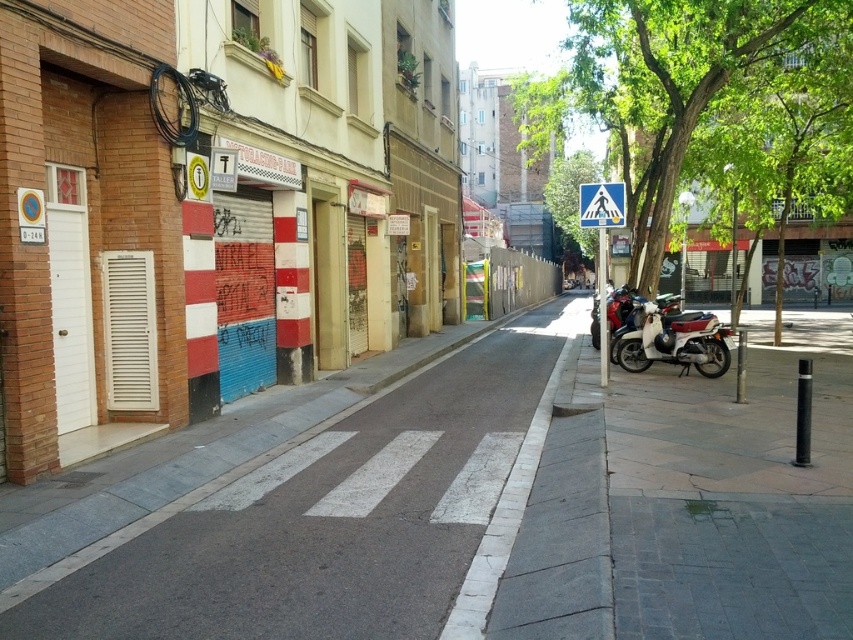
Is metallic blue scooter at right bigger than blue plastic pedestrian crossing sign at center?

No, metallic blue scooter at right is not bigger than blue plastic pedestrian crossing sign at center.

Which is below, metallic blue scooter at right or blue plastic pedestrian crossing sign at center?

Positioned lower is metallic blue scooter at right.

Is point (701, 330) closer to camera compared to point (604, 212)?

No, it is behind (604, 212).

At what (x,y) coordinates should I click in order to perform the action: click on metallic blue scooter at right. Please return your answer as a coordinate pair (x, y). Looking at the image, I should click on (674, 340).

Looking at this image, is the position of gray concrete pavement at center more distant than that of green leafy tree at upper right?

No, it is in front of green leafy tree at upper right.

Does point (61, 524) come farther from viewer compared to point (672, 77)?

No, (61, 524) is in front of (672, 77).

Which is behind, point (44, 572) or point (782, 3)?

The point (782, 3) is more distant.

Image resolution: width=853 pixels, height=640 pixels. In order to click on gray concrete pavement at center in this screenshot , I will do `click(300, 508)`.

Can you confirm if gray concrete pavement at center is positioned to the right of blue plastic pedestrian crossing sign at center?

Incorrect, gray concrete pavement at center is not on the right side of blue plastic pedestrian crossing sign at center.

Identify the location of gray concrete pavement at center. This screenshot has width=853, height=640. (300, 508).

Does point (218, 634) lie behind point (605, 195)?

No, it is in front of (605, 195).

Where is `gray concrete pavement at center`? The width and height of the screenshot is (853, 640). gray concrete pavement at center is located at coordinates (300, 508).